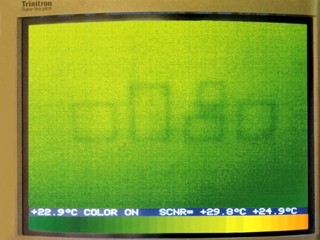
Where is `left monitor frame`? The height and width of the screenshot is (240, 320). left monitor frame is located at coordinates (5, 123).